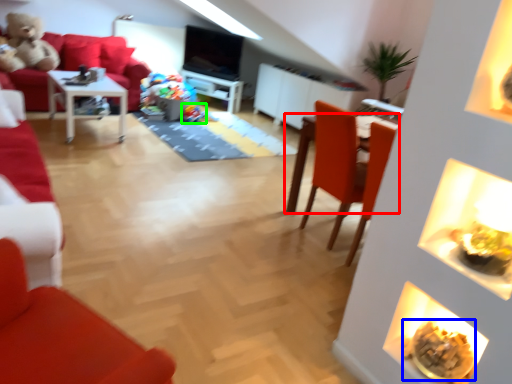
Question: Based on their relative distances, which object is nearer to table (highlighted by a red box)? Choose from food (highlighted by a blue box) and food (highlighted by a green box).

Choices:
 (A) food
 (B) food

Answer: (A)